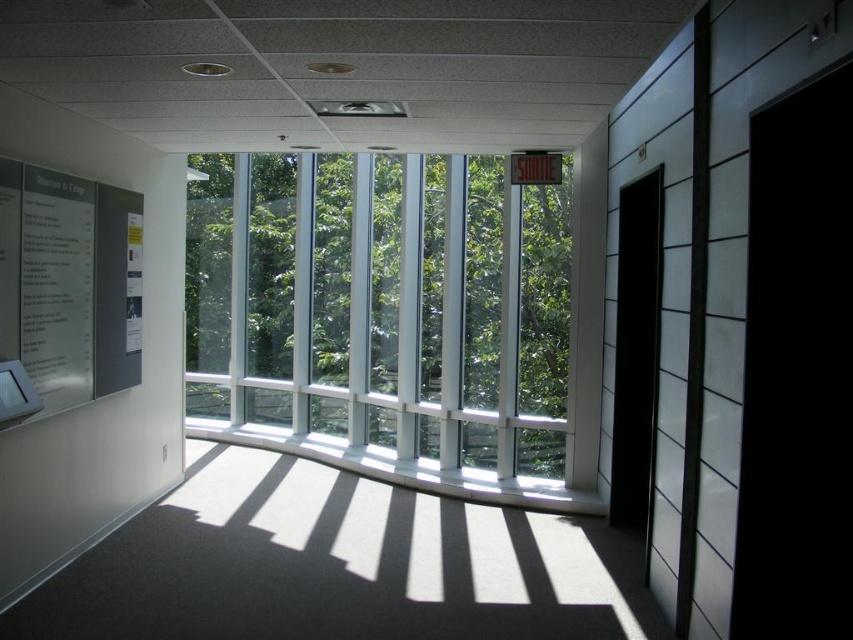
Question: Can you confirm if matte gray bulletin board at left is wider than white glossy poster at left?

Choices:
 (A) no
 (B) yes

Answer: (B)

Question: Is matte gray bulletin board at left behind white glossy poster at left?

Choices:
 (A) yes
 (B) no

Answer: (B)

Question: Which is nearer to the matte gray bulletin board at left?

Choices:
 (A) white glossy poster at left
 (B) transparent glass window at center

Answer: (A)

Question: Can you confirm if transparent glass window at center is positioned to the right of matte gray bulletin board at left?

Choices:
 (A) yes
 (B) no

Answer: (A)

Question: Which point is closer to the camera?

Choices:
 (A) (267, 388)
 (B) (106, 209)
 (C) (137, 337)

Answer: (B)

Question: Estimate the real-world distances between objects in this image. Which object is farther from the white glossy poster at left?

Choices:
 (A) transparent glass window at center
 (B) matte gray bulletin board at left

Answer: (A)